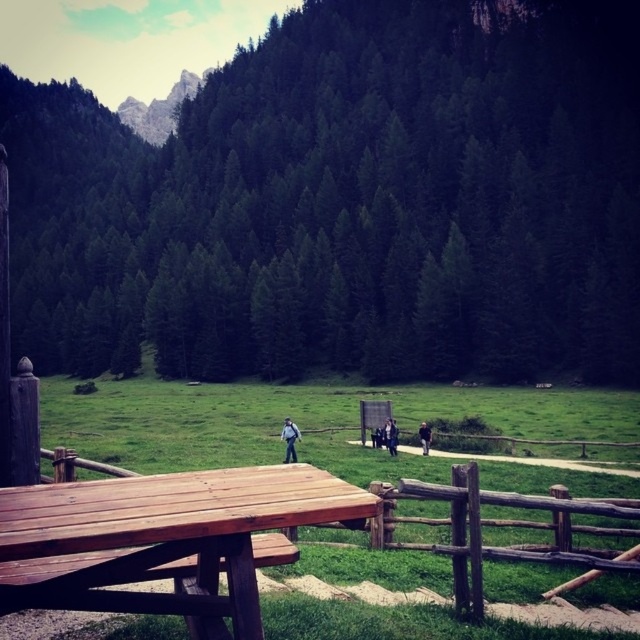
You are planning to wear one of the jackets you see in the image. The dark blue fabric jacket at center and the light brown leather jacket at center are both at the center of the picnic table. Which jacket would you need to bend lower to pick up if they are placed side by side?

The dark blue fabric jacket at center is larger in size compared to the light brown leather jacket at center, so you would need to bend lower to pick up the light brown leather jacket at center since it is smaller and might be placed lower or require less bending.

You are planning to take a photo of the rugged stone mountain at upper left from the wooden picnic table at center. Will the picnic table block your view of the mountain?

The wooden picnic table at center is in front of rugged stone mountain at upper left, so it will block your view of the mountain when taking a photo from that position.

You are standing at the picnic table and want to pick up the dark blue fabric jacket at center and the light brown leather jacket at center. Which jacket is closer to your left hand side?

The dark blue fabric jacket at center is to the left of the light brown leather jacket at center, so it is closer to your left hand side.